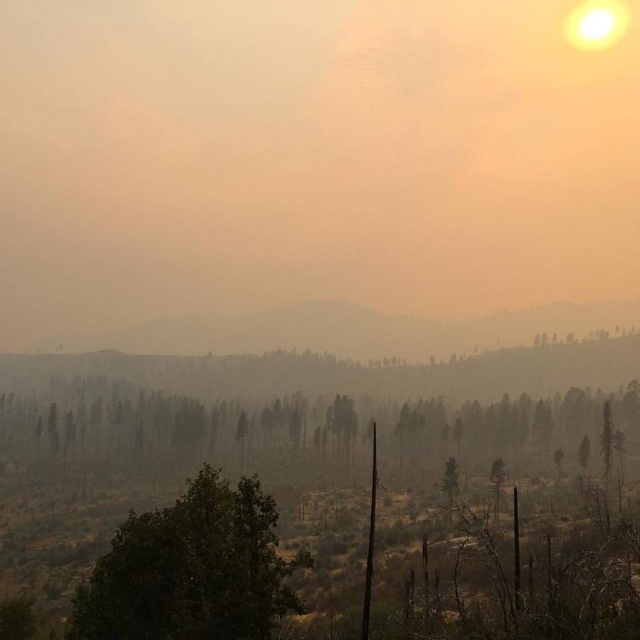
You are an environmental scientist analyzing the image. You observe the green matte trees at center and the green leafy tree at center. Based on their positions in the scene, which one is closer to the horizon?

The green leafy tree at center is closer to the horizon because the green matte trees at center are located above it, indicating they are in front and blocking part of the view to the horizon.

You are an environmental scientist analyzing the landscape. You observe the green matte trees at center and the green leafy tree at center. Which of these two has a greater height?

The green leafy tree at center has a greater height than the green matte trees at center.